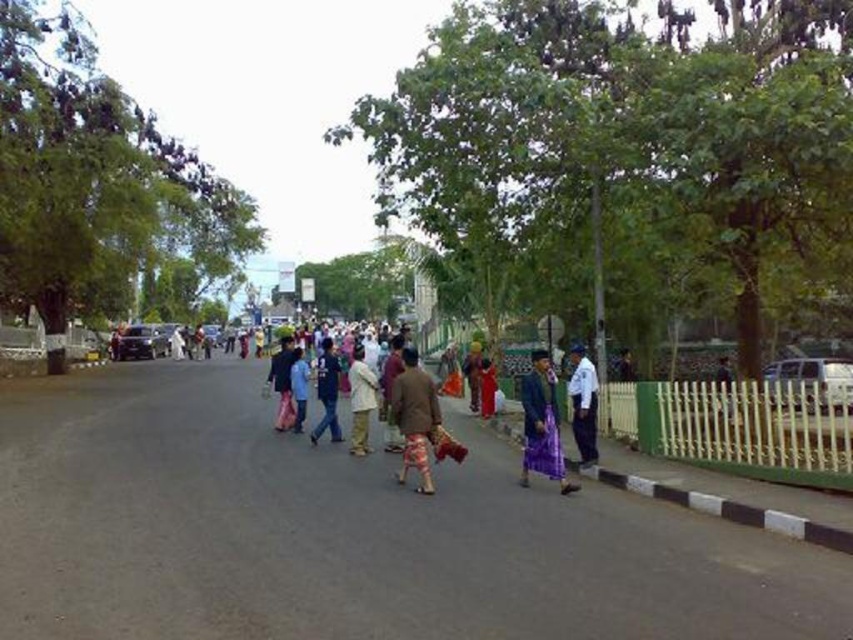
You are a passerby standing on the road in the image. You notice two people wearing light brown fabric pants at center and blue fabric shirt at center. Which person is closer to the green fence on the right side of the road?

The light brown fabric pants at center is to the right of the blue fabric shirt at center, so the person wearing light brown fabric pants at center is closer to the green fence on the right side of the road.

You are a pedestrian standing on the road and you see the brown woven cloth at center and the blue fabric shirt at center. Which object is closer to the ground?

The brown woven cloth at center is located below the blue fabric shirt at center, so it is closer to the ground.

You are a delivery person trying to place a small package on the road. You see a brown woven cloth at center and a blue fabric shirt at center. Which object can you place the package on without it falling off?

The brown woven cloth at center has a smaller size compared to blue fabric shirt at center. Therefore, the blue fabric shirt at center is larger and can hold the package more securely without it falling off.